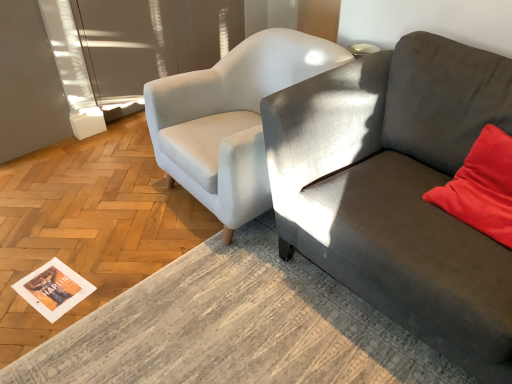
This screenshot has height=384, width=512. I want to click on free space behind white paper magazine at lower left, so click(69, 247).